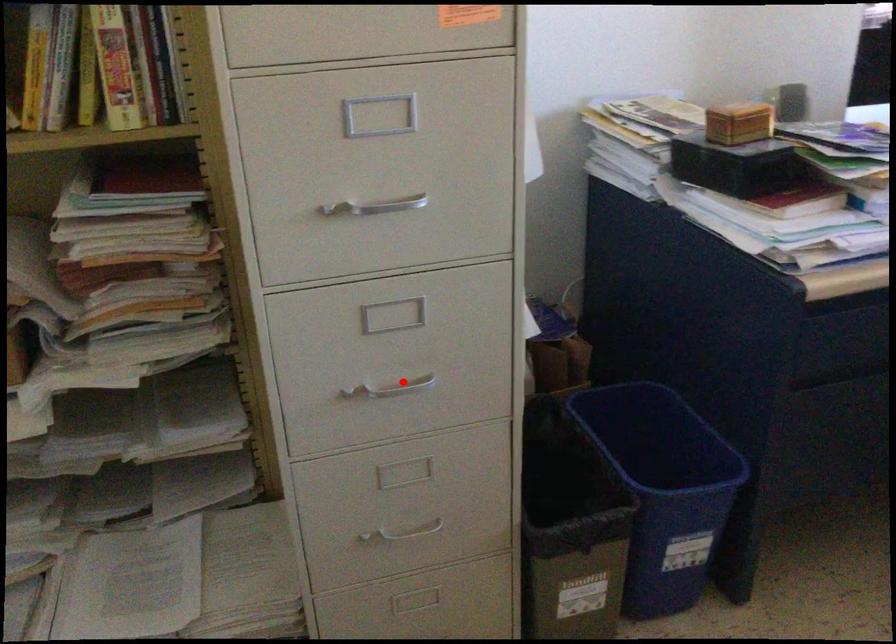
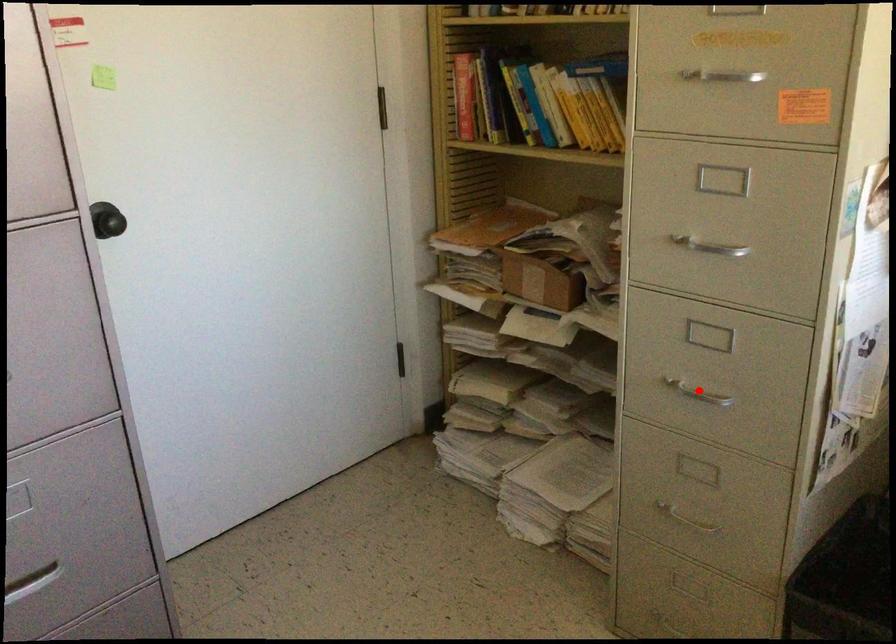
I am providing you with two images of the same scene from different viewpoints. A red point is marked on the first image and another point is marked on the second image. Is the red point in image1 aligned with the point shown in image2?

Yes